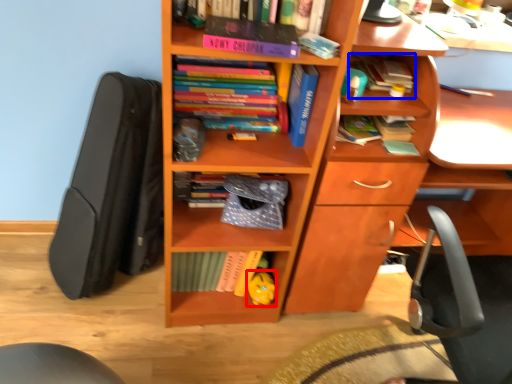
Question: Which object is closer to the camera taking this photo, toy (highlighted by a red box) or book (highlighted by a blue box)?

Choices:
 (A) toy
 (B) book

Answer: (B)